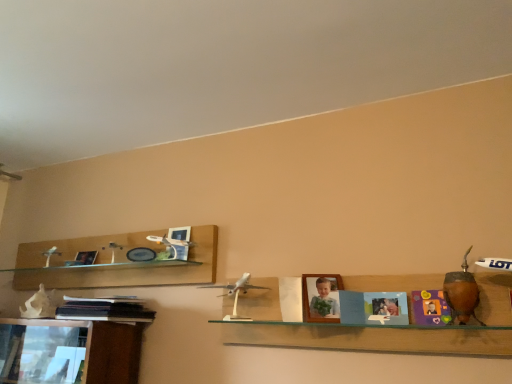
Question: Can you confirm if matte plastic picture frame at upper left, the 1th picture frame in the back-to-front sequence, is shorter than silver metallic airplane at center, which is the 1th toy from left to right?

Choices:
 (A) no
 (B) yes

Answer: (B)

Question: From a real-world perspective, is matte plastic picture frame at upper left, which is counted as the first picture frame, starting from the left, located beneath silver metallic airplane at center, acting as the second toy starting from the right?

Choices:
 (A) yes
 (B) no

Answer: (B)

Question: Is matte plastic picture frame at upper left, which is the 2th picture frame from right to left, closer to the viewer compared to silver metallic airplane at center, acting as the second toy starting from the right?

Choices:
 (A) no
 (B) yes

Answer: (A)

Question: Considering the relative sizes of matte plastic picture frame at upper left, the 1th picture frame in the back-to-front sequence, and silver metallic airplane at center, acting as the second toy starting from the right, in the image provided, is matte plastic picture frame at upper left, the 1th picture frame in the back-to-front sequence, wider than silver metallic airplane at center, acting as the second toy starting from the right,?

Choices:
 (A) yes
 (B) no

Answer: (B)

Question: From a real-world perspective, relative to white plastic airplane at center, is matte plastic picture frame at upper left, which is the 2th picture frame from right to left, vertically above or below?

Choices:
 (A) above
 (B) below

Answer: (A)

Question: Would you say matte plastic picture frame at upper left, the 1th picture frame in the back-to-front sequence, is to the left or to the right of white plastic airplane at center in the picture?

Choices:
 (A) left
 (B) right

Answer: (A)

Question: In terms of size, does matte plastic picture frame at upper left, the 1th picture frame in the back-to-front sequence, appear bigger or smaller than white plastic airplane at center?

Choices:
 (A) small
 (B) big

Answer: (A)

Question: Considering their positions, is matte plastic picture frame at upper left, which is counted as the first picture frame, starting from the left, located in front of or behind white plastic airplane at center?

Choices:
 (A) front
 (B) behind

Answer: (B)

Question: Does point (82, 314) appear closer or farther from the camera than point (467, 291)?

Choices:
 (A) closer
 (B) farther

Answer: (B)

Question: From a real-world perspective, is black matte book at lower left above or below brown wooden vase at right, which is counted as the 2th toy, starting from the left?

Choices:
 (A) below
 (B) above

Answer: (A)

Question: From their relative heights in the image, would you say black matte book at lower left is taller or shorter than brown wooden vase at right, the second toy when ordered from back to front?

Choices:
 (A) tall
 (B) short

Answer: (B)

Question: Is black matte book at lower left bigger or smaller than brown wooden vase at right, which appears as the 1th toy when viewed from the right?

Choices:
 (A) small
 (B) big

Answer: (B)

Question: Is wooden photo frame at center, which is counted as the second picture frame, starting from the left, taller or shorter than silver metallic airplane at center, which ranks as the 2th toy in front-to-back order?

Choices:
 (A) short
 (B) tall

Answer: (B)

Question: Looking at their shapes, would you say wooden photo frame at center, which is counted as the second picture frame, starting from the left, is wider or thinner than silver metallic airplane at center, the 1th toy positioned from the back?

Choices:
 (A) wide
 (B) thin

Answer: (B)